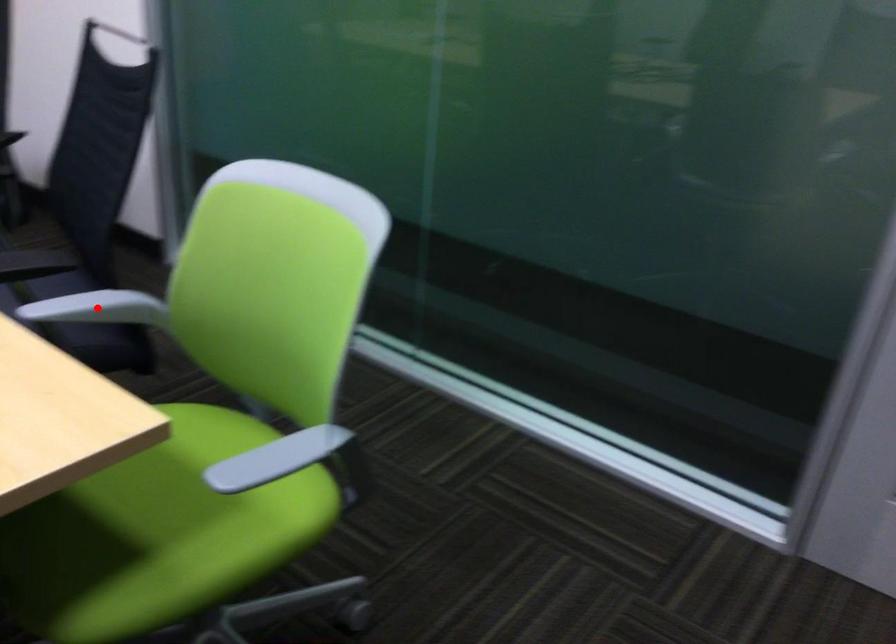
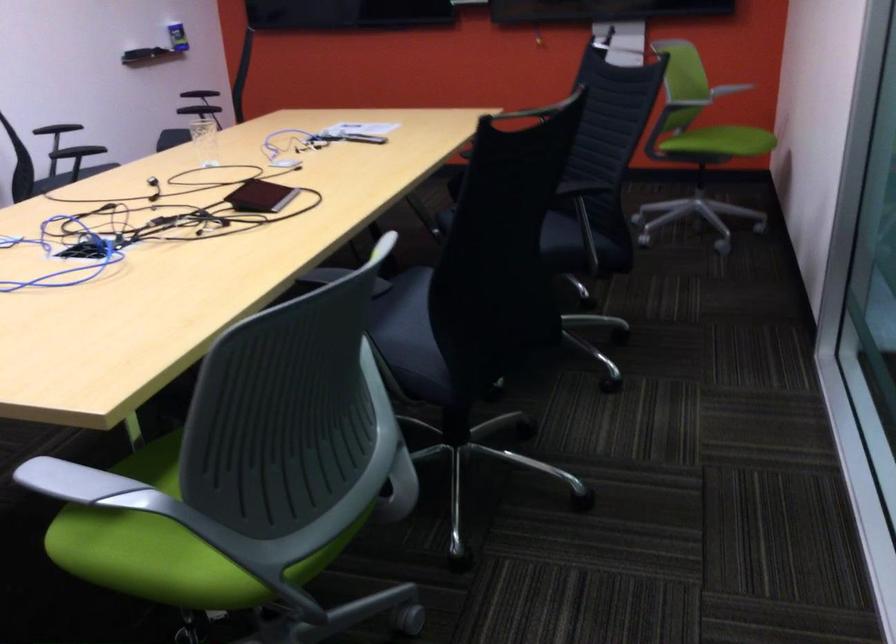
Question: I am providing you with two images of the same scene from different viewpoints. A red point is marked on the first image. Can you still see the location of the red point in image 2?

Choices:
 (A) Yes
 (B) No

Answer: (B)